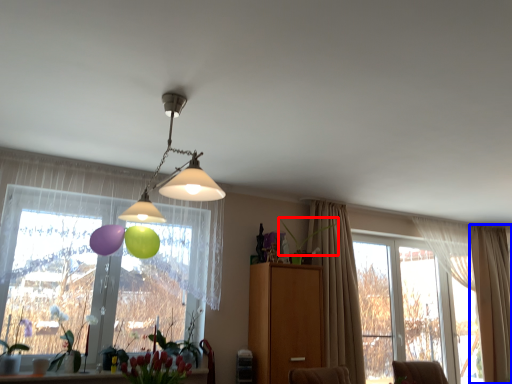
Question: Which point is closer to the camera, plant (highlighted by a red box) or curtain (highlighted by a blue box)?

Choices:
 (A) plant
 (B) curtain

Answer: (A)